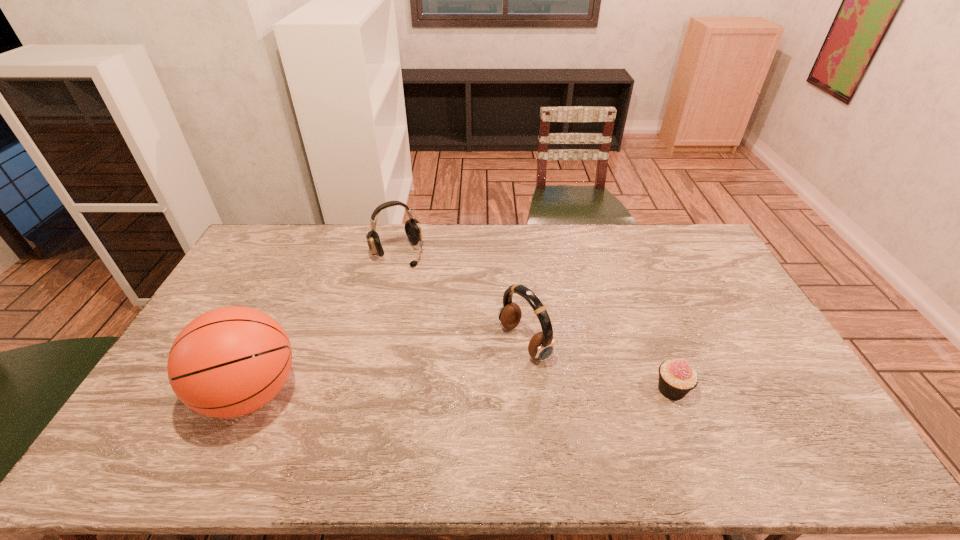
The height and width of the screenshot is (540, 960). What are the coordinates of `the leftmost object` in the screenshot? It's located at (228, 362).

Locate an element on the screen. The height and width of the screenshot is (540, 960). the tallest object is located at coordinates (228, 362).

Locate an element on the screen. This screenshot has width=960, height=540. the shortest object is located at coordinates (676, 377).

Where is `cupcake`? Image resolution: width=960 pixels, height=540 pixels. cupcake is located at coordinates (676, 377).

I want to click on the nearer headset, so click(541, 345).

What are the coordinates of `the third object from left to right` in the screenshot? It's located at (541, 345).

At what (x,y) coordinates should I click in order to perform the action: click on the farther headset. Please return your answer as a coordinate pair (x, y). The width and height of the screenshot is (960, 540). Looking at the image, I should click on (412, 227).

Find the location of a particular element. the second object from left to right is located at coordinates (412, 227).

Identify the location of vacant space positioned on the back of the tallest object. This screenshot has height=540, width=960. (279, 330).

Image resolution: width=960 pixels, height=540 pixels. In order to click on vacant position located 0.150m on the right of the shortest object in this screenshot , I will do `click(744, 389)`.